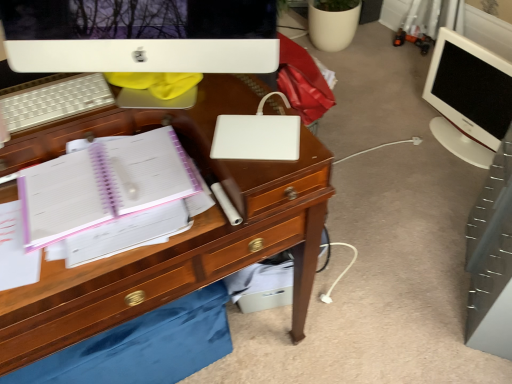
Question: Considering the positions of point (214, 139) and point (262, 61), is point (214, 139) closer or farther from the camera than point (262, 61)?

Choices:
 (A) farther
 (B) closer

Answer: (A)

Question: In terms of size, does white matte laptop at center appear bigger or smaller than white glossy computer monitor at upper center, which appears as the 2th computer monitor when viewed from the back?

Choices:
 (A) big
 (B) small

Answer: (B)

Question: Which of these objects is positioned closest to the pink glossy notebook at left?

Choices:
 (A) white glossy monitor at right, the second computer monitor positioned from the front
 (B) white matte laptop at center
 (C) wooden drawer at lower center
 (D) white plastic keyboard at upper left
 (E) white glossy computer monitor at upper center, which appears as the 2th computer monitor when viewed from the back

Answer: (D)

Question: Which object is the closest to the white matte laptop at center?

Choices:
 (A) pink glossy notebook at left
 (B) wooden drawer at lower center
 (C) white glossy computer monitor at upper center, which ranks as the 1th computer monitor in left-to-right order
 (D) white plastic keyboard at upper left
 (E) white glossy monitor at right, the first computer monitor viewed from the right

Answer: (C)